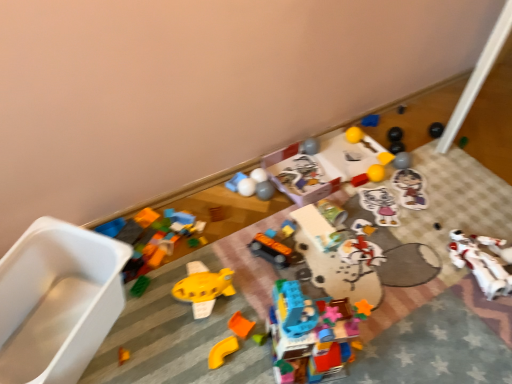
The width and height of the screenshot is (512, 384). I want to click on free area in between matte plastic sticker at center, positioned as the 16th toy in left-to-right order, and white plastic robot at lower right, which appears as the seventeenth toy when viewed from the left, so click(436, 218).